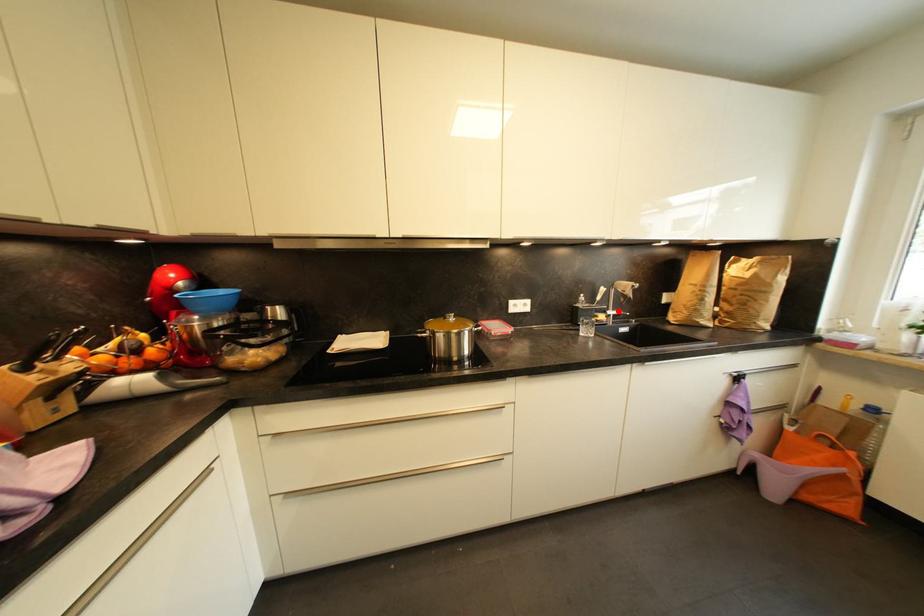
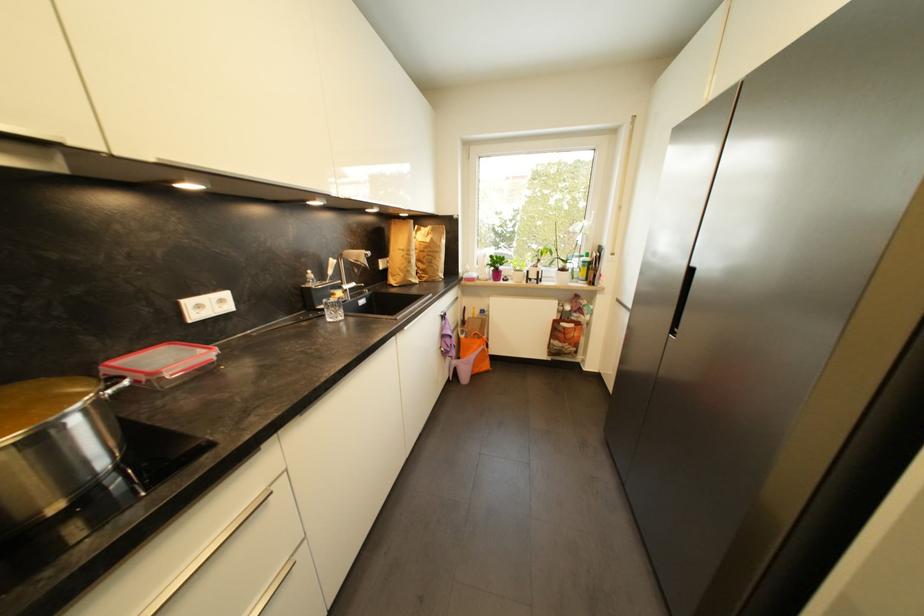
In the second image, find the point that corresponds to the highlighted location in the first image.

(353, 285)